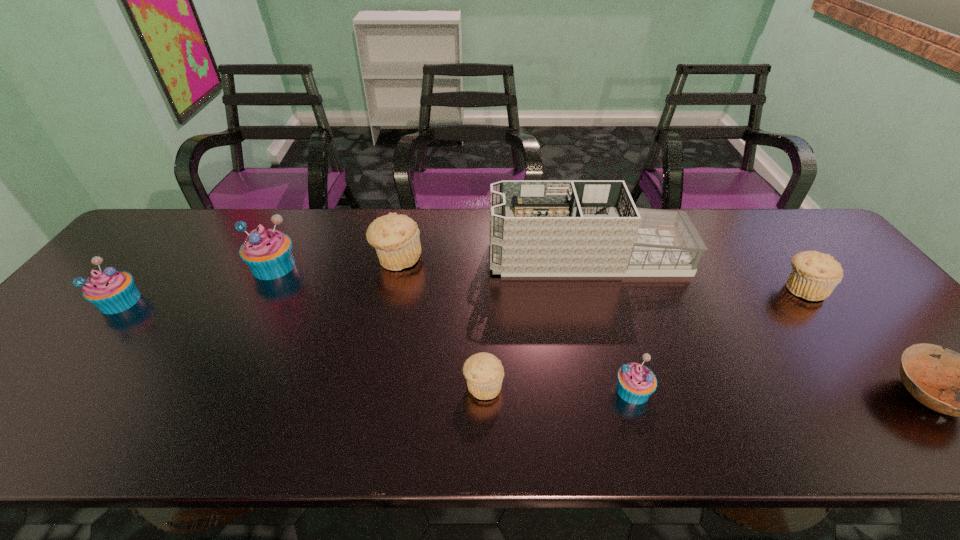
Locate an element on the screen. Image resolution: width=960 pixels, height=540 pixels. free spot located on the right of the smallest blue muffin is located at coordinates (806, 390).

Where is `vacant space located 0.200m on the left of the nearest beige muffin`? vacant space located 0.200m on the left of the nearest beige muffin is located at coordinates (373, 386).

I want to click on dollhouse located at the far edge, so click(538, 228).

The width and height of the screenshot is (960, 540). Identify the location of object situated at the left edge. (x=111, y=291).

You are a GUI agent. You are given a task and a screenshot of the screen. Output one action in this format:
    pyautogui.click(x=<x>, y=<y>)
    Task: Click on the object positioned at the right edge
    
    Given the screenshot: What is the action you would take?
    pyautogui.click(x=814, y=275)

The image size is (960, 540). Find the location of `vacant space at the far edge`. vacant space at the far edge is located at coordinates (282, 229).

I want to click on vacant space at the near edge, so click(x=642, y=417).

Locate an element on the screen. The height and width of the screenshot is (540, 960). blank space at the left edge of the desktop is located at coordinates (74, 330).

The width and height of the screenshot is (960, 540). Identify the location of free space at the far right corner of the desktop. (791, 235).

Image resolution: width=960 pixels, height=540 pixels. Identify the location of free space between the leftmost blue muffin and the second muffin from right to left. (376, 346).